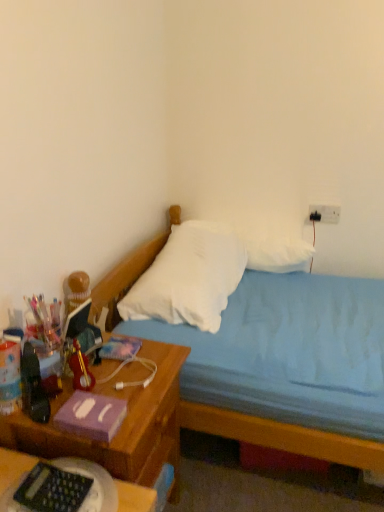
Question: Is white soft pillow at center, the 1th pillow in the front-to-back sequence, taller than white soft pillow at upper center, arranged as the 1th pillow when viewed from the back?

Choices:
 (A) no
 (B) yes

Answer: (A)

Question: Does white soft pillow at center, the 2th pillow viewed from the back, have a smaller size compared to white soft pillow at upper center, arranged as the 1th pillow when viewed from the back?

Choices:
 (A) yes
 (B) no

Answer: (B)

Question: From the image's perspective, is white soft pillow at center, the 2th pillow viewed from the back, under white soft pillow at upper center, which appears as the 2th pillow when viewed from the front?

Choices:
 (A) no
 (B) yes

Answer: (B)

Question: Is white soft pillow at center, the 2th pillow viewed from the back, wider than white soft pillow at upper center, arranged as the 1th pillow when viewed from the back?

Choices:
 (A) no
 (B) yes

Answer: (B)

Question: From the image's perspective, is white soft pillow at center, the 2th pillow viewed from the back, over white soft pillow at upper center, which appears as the 2th pillow when viewed from the front?

Choices:
 (A) yes
 (B) no

Answer: (B)

Question: From a real-world perspective, relative to blue fabric bed at center, is white soft pillow at center, the 1th pillow in the front-to-back sequence, vertically above or below?

Choices:
 (A) below
 (B) above

Answer: (B)

Question: Based on their sizes in the image, would you say white soft pillow at center, the 1th pillow in the front-to-back sequence, is bigger or smaller than blue fabric bed at center?

Choices:
 (A) small
 (B) big

Answer: (A)

Question: From the image's perspective, is white soft pillow at center, the 2th pillow viewed from the back, located above or below blue fabric bed at center?

Choices:
 (A) above
 (B) below

Answer: (A)

Question: Considering the positions of white soft pillow at center, the 1th pillow in the front-to-back sequence, and blue fabric bed at center in the image, is white soft pillow at center, the 1th pillow in the front-to-back sequence, taller or shorter than blue fabric bed at center?

Choices:
 (A) short
 (B) tall

Answer: (A)

Question: From a real-world perspective, relative to black plastic keyboard at lower left, is woodennightstand at left vertically above or below?

Choices:
 (A) below
 (B) above

Answer: (A)

Question: Choose the correct answer: Is woodennightstand at left inside black plastic keyboard at lower left or outside it?

Choices:
 (A) outside
 (B) inside

Answer: (A)

Question: Is woodennightstand at left taller or shorter than black plastic keyboard at lower left?

Choices:
 (A) tall
 (B) short

Answer: (A)

Question: In the image, is woodennightstand at left positioned in front of or behind black plastic keyboard at lower left?

Choices:
 (A) behind
 (B) front

Answer: (A)

Question: Considering the positions of black plastic keyboard at lower left and blue fabric bed at center in the image, is black plastic keyboard at lower left taller or shorter than blue fabric bed at center?

Choices:
 (A) tall
 (B) short

Answer: (B)

Question: Is black plastic keyboard at lower left inside the boundaries of blue fabric bed at center, or outside?

Choices:
 (A) outside
 (B) inside

Answer: (A)